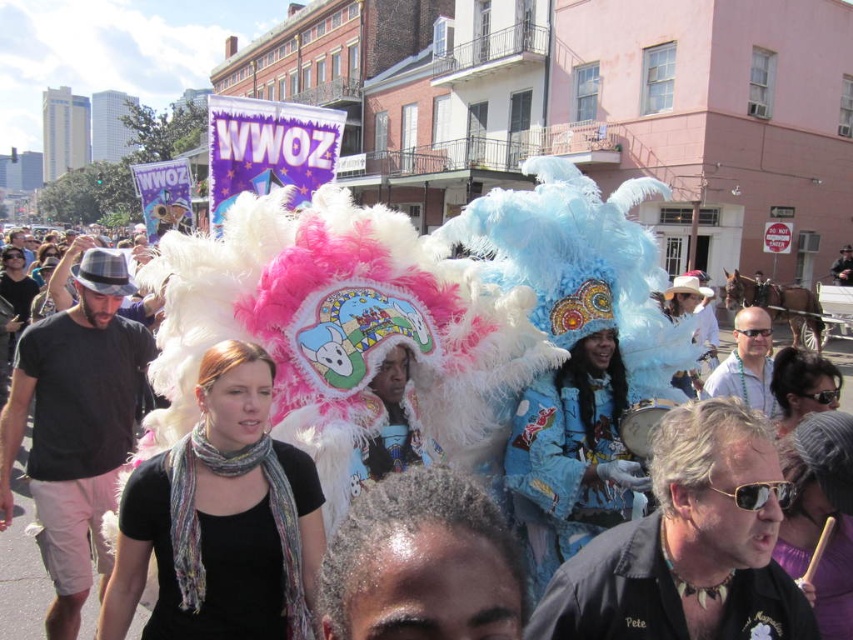
Does point (318, 536) lie in front of point (810, 374)?

Yes, it is.

Looking at this image, does black scarf at center have a larger size compared to multicolored feather headdress at center?

Indeed, black scarf at center has a larger size compared to multicolored feather headdress at center.

Find the location of a particular element. black scarf at center is located at coordinates (221, 518).

Who is more distant from viewer, [33,634] or [786,346]?

The point [786,346] is behind.

Can you confirm if feathered headdress at center is smaller than multicolored feather headdress at center?

No.

Where is `feathered headdress at center`? This screenshot has height=640, width=853. feathered headdress at center is located at coordinates coord(20,586).

This screenshot has height=640, width=853. I want to click on feathered headdress at center, so pos(20,586).

Does black scarf at center lie in front of feathered headdress at center?

Yes, black scarf at center is in front of feathered headdress at center.

Is point (202, 541) closer to camera compared to point (78, 244)?

Yes, point (202, 541) is closer to viewer.

In order to click on black scarf at center in this screenshot , I will do `click(221, 518)`.